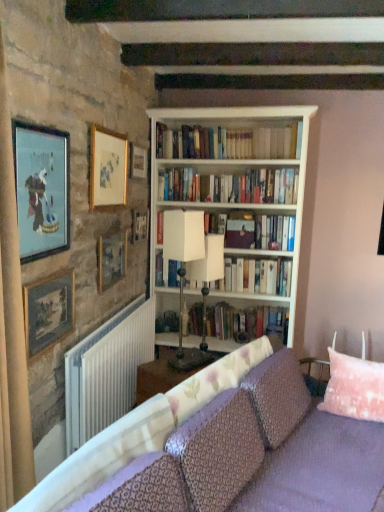
The height and width of the screenshot is (512, 384). Identify the location of free point above white paperbacks at upper center, the fourth book when ordered from bottom to top (from a real-world perspective). (216, 123).